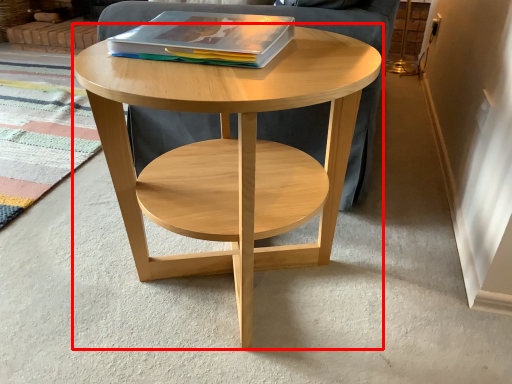
Question: From the image's perspective, where is coffee table (annotated by the red box) located relative to magazine?

Choices:
 (A) above
 (B) below

Answer: (B)